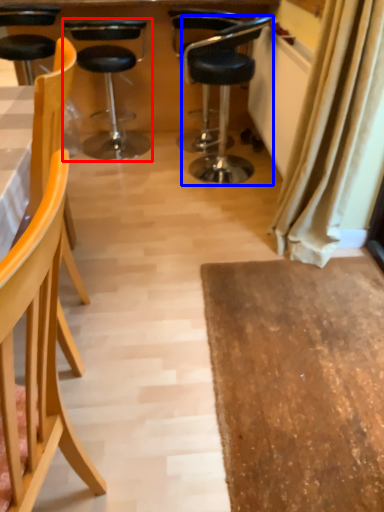
Question: Which object is further to the camera taking this photo, chair (highlighted by a red box) or chair (highlighted by a blue box)?

Choices:
 (A) chair
 (B) chair

Answer: (A)